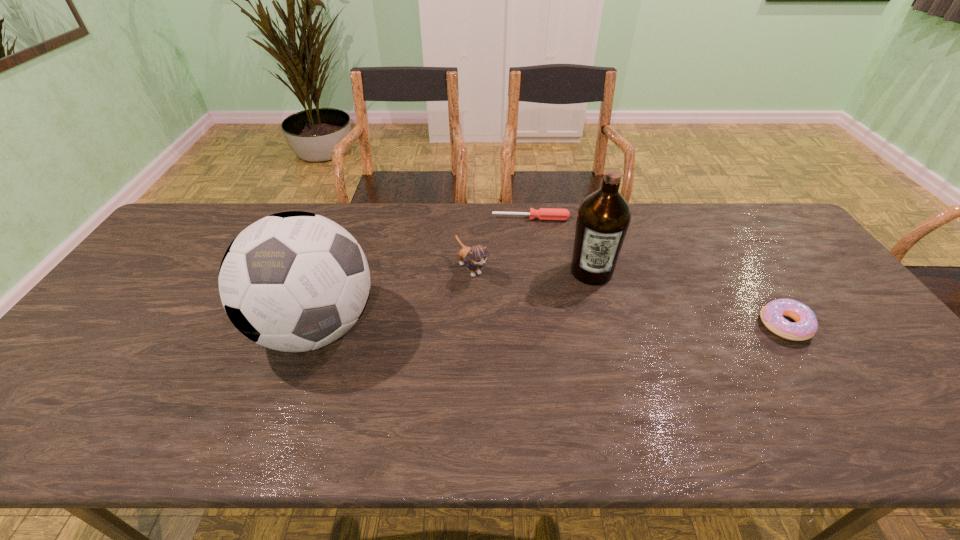
Where is `vacant point located between the olive oil and the soccer ball`? vacant point located between the olive oil and the soccer ball is located at coordinates (454, 300).

Where is `free spot between the soccer ball and the screwdriver`? This screenshot has width=960, height=540. free spot between the soccer ball and the screwdriver is located at coordinates (423, 273).

I want to click on unoccupied position between the kitten and the shortest object, so click(x=501, y=244).

In order to click on blank region between the third shortest object and the shortest object in this screenshot , I will do `click(501, 244)`.

Image resolution: width=960 pixels, height=540 pixels. Identify the location of vacant area that lies between the third tallest object and the soccer ball. (394, 298).

You are a GUI agent. You are given a task and a screenshot of the screen. Output one action in this format:
    pyautogui.click(x=<x>, y=<y>)
    Task: Click on the empty space between the second object from left to right and the fourth tallest object
    This screenshot has width=960, height=540.
    Given the screenshot: What is the action you would take?
    pyautogui.click(x=628, y=296)

Where is `object that is the second closest to the olive oil`? Image resolution: width=960 pixels, height=540 pixels. object that is the second closest to the olive oil is located at coordinates (474, 257).

Where is `the second closest object to the olive oil`? the second closest object to the olive oil is located at coordinates (474, 257).

Identify the location of vacant point that satisfies the following two spatial constraints: 1. on the back side of the shortest object; 2. on the left side of the fourth object from right to left. The height and width of the screenshot is (540, 960). (472, 219).